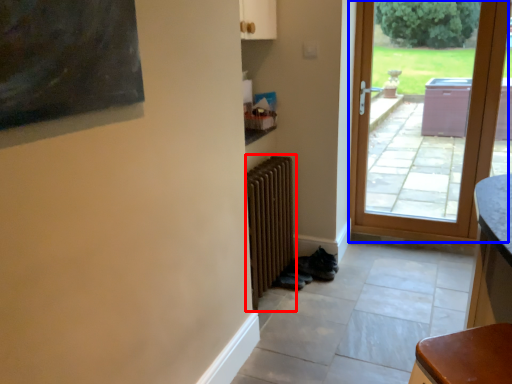
Question: Which object is closer to the camera taking this photo, radiator (highlighted by a red box) or door (highlighted by a blue box)?

Choices:
 (A) radiator
 (B) door

Answer: (A)